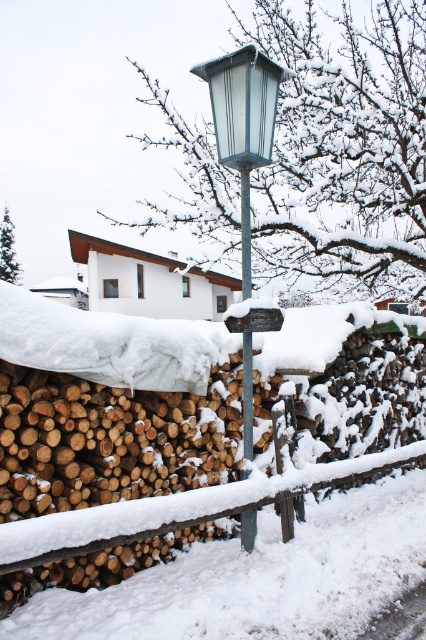
Is metallic glass street light at center positioned before white glass lamp at center?

That is False.

Can you confirm if metallic glass street light at center is positioned to the right of white glass lamp at center?

Yes, metallic glass street light at center is to the right of white glass lamp at center.

Locate an element on the screen. metallic glass street light at center is located at coordinates (244, 122).

The image size is (426, 640). Find the location of `metallic glass street light at center`. metallic glass street light at center is located at coordinates (244, 122).

Who is positioned more to the left, white glass lamp at center or wooden sign at center?

white glass lamp at center is more to the left.

Is white glass lamp at center below wooden sign at center?

No.

In order to click on white glass lamp at center in this screenshot , I will do pos(242,104).

Identify the location of white glass lamp at center. (242, 104).

Between snow-covered wooden fence at lower center and wooden sign at center, which one appears on the left side from the viewer's perspective?

snow-covered wooden fence at lower center

Does snow-covered wooden fence at lower center have a greater height compared to wooden sign at center?

Indeed, snow-covered wooden fence at lower center has a greater height compared to wooden sign at center.

The height and width of the screenshot is (640, 426). What do you see at coordinates (365, 397) in the screenshot?
I see `snow-covered wooden fence at lower center` at bounding box center [365, 397].

This screenshot has height=640, width=426. Identify the location of snow-covered wooden fence at lower center. (365, 397).